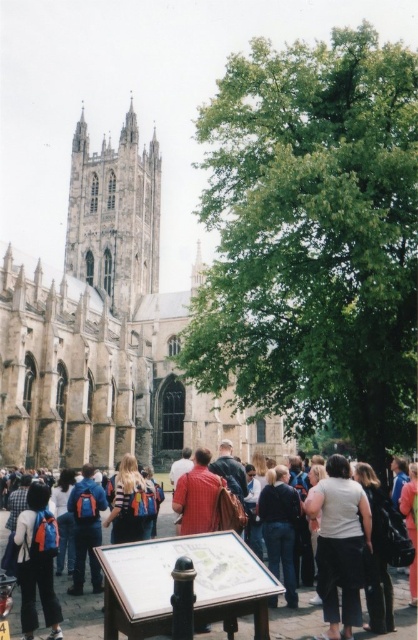
How far apart are stone gothic cathedral at center and orange backpack at center?

They are 94.05 feet apart.

Can you confirm if stone gothic cathedral at center is taller than orange backpack at center?

Correct, stone gothic cathedral at center is much taller as orange backpack at center.

The height and width of the screenshot is (640, 418). Identify the location of stone gothic cathedral at center. (107, 332).

Can you confirm if white cotton shirt at center is thinner than dark blue leather jacket at center?

No.

Between point (348, 476) and point (404, 508), which one is positioned in front?

Positioned in front is point (348, 476).

What are the coordinates of `white cotton shirt at center` in the screenshot? It's located at (339, 545).

Consider the image. Measure the distance between dark blue jeans at lower right and striped shirt backpack at center.

A distance of 19.16 meters exists between dark blue jeans at lower right and striped shirt backpack at center.

Consider the image. Does dark blue jeans at lower right appear on the right side of striped shirt backpack at center?

Yes, dark blue jeans at lower right is to the right of striped shirt backpack at center.

Who is more distant from viewer, (377,605) or (132,468)?

Point (132,468)

Locate an element on the screen. The width and height of the screenshot is (418, 640). dark blue jeans at lower right is located at coordinates (377, 554).